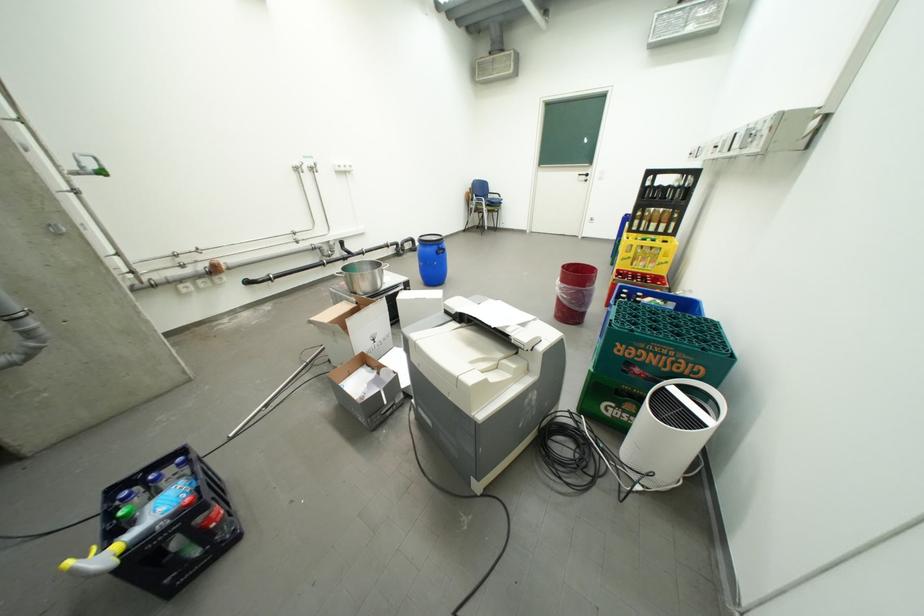
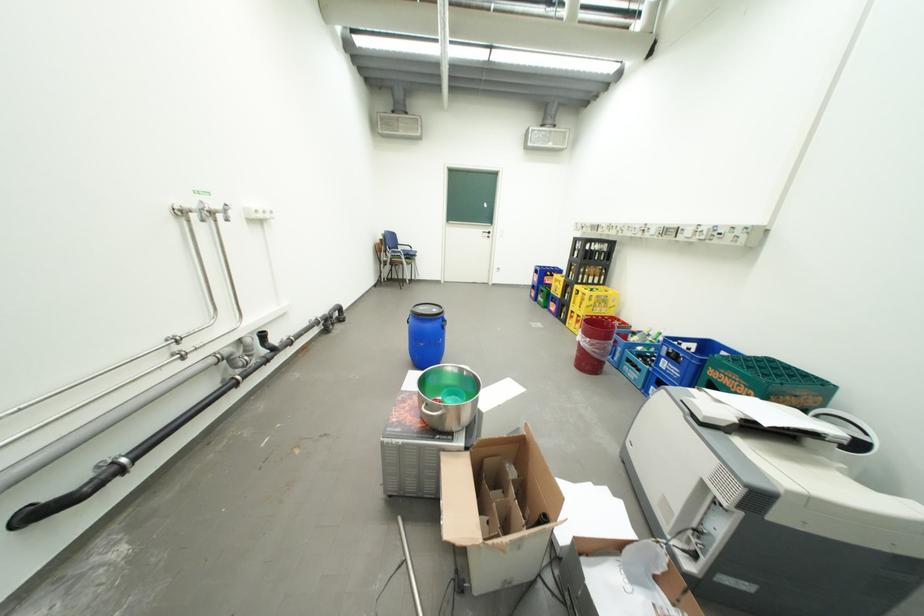
Find the pixel in the second image that matches pixel 570 284 in the first image.

(599, 341)